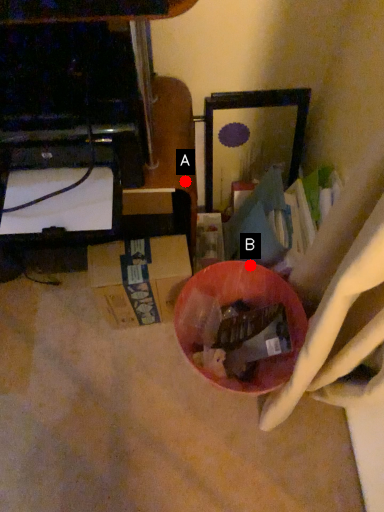
Question: Two points are circled on the image, labeled by A and B beside each circle. Which of the following is the closest to the observer?

Choices:
 (A) A is closer
 (B) B is closer

Answer: (A)